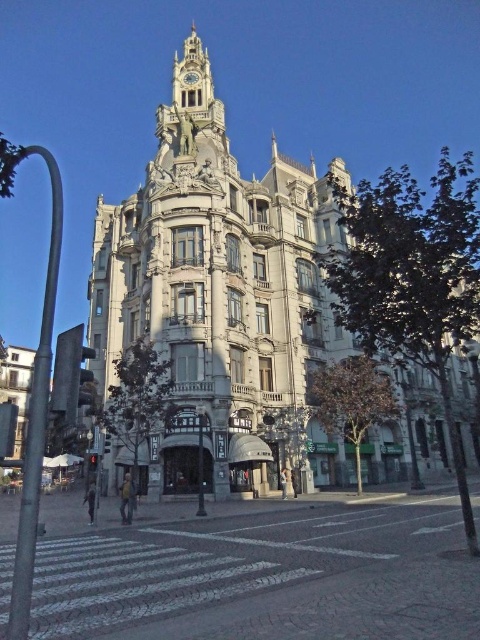
From the picture: Between gray stone building at center and gold metallic clock at upper center, which one appears on the right side from the viewer's perspective?

Positioned to the right is gray stone building at center.

Between point (193, 474) and point (195, 77), which one is positioned behind?

The point (195, 77) is behind.

This screenshot has width=480, height=640. Find the location of `gray stone building at center`. gray stone building at center is located at coordinates (222, 300).

Can you confirm if matte gray building at left is positioned to the left of gold metallic clock at upper center?

Indeed, matte gray building at left is positioned on the left side of gold metallic clock at upper center.

Looking at this image, who is positioned more to the left, matte gray building at left or gold metallic clock at upper center?

matte gray building at left is more to the left.

Looking at this image, who is more distant from viewer, (25, 428) or (189, 83)?

Positioned behind is point (25, 428).

At what (x,y) coordinates should I click in order to perform the action: click on matte gray building at left. Please return your answer as a coordinate pair (x, y). The height and width of the screenshot is (640, 480). Looking at the image, I should click on (16, 387).

Between gray stone building at center and matte gray building at left, which one has less height?

matte gray building at left is shorter.

Which is behind, point (143, 456) or point (8, 396)?

Point (8, 396)

This screenshot has width=480, height=640. Find the location of `gray stone building at center`. gray stone building at center is located at coordinates (222, 300).